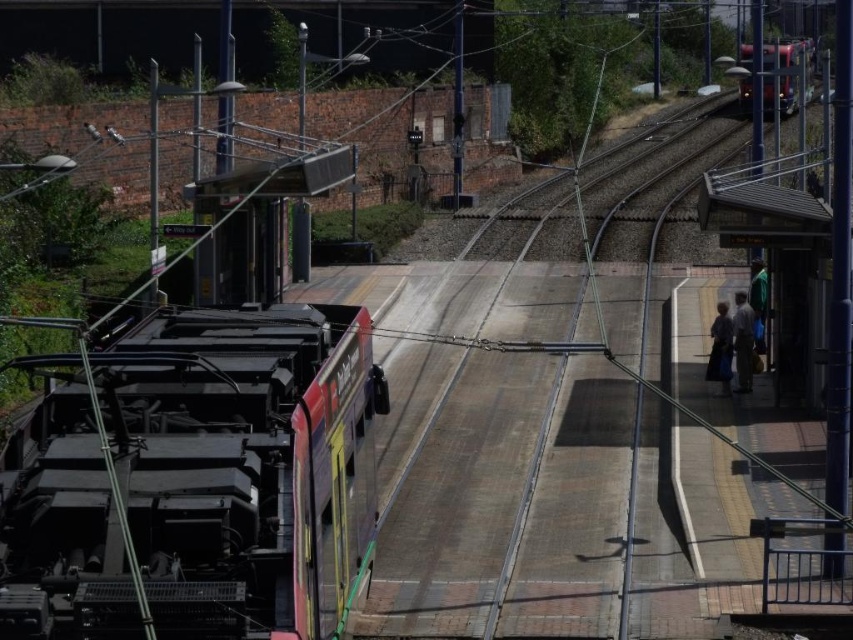
Question: Which point is closer to the camera?

Choices:
 (A) dark gray fabric bag at right
 (B) metallic red train at upper right
 (C) green fabric jacket at right

Answer: (A)

Question: From the image, what is the correct spatial relationship of dark gray fabric bag at right in relation to green fabric jacket at right?

Choices:
 (A) below
 (B) above

Answer: (A)

Question: Is metallic red train at left wider than light brown fabric coat at right?

Choices:
 (A) yes
 (B) no

Answer: (A)

Question: Among these points, which one is farthest from the camera?

Choices:
 (A) (740, 355)
 (B) (711, 352)

Answer: (B)

Question: Which point is closer to the camera?

Choices:
 (A) (294, 550)
 (B) (737, 330)
 (C) (712, 356)
 (D) (784, 67)

Answer: (A)

Question: Is metallic red train at left smaller than metallic red train at upper right?

Choices:
 (A) yes
 (B) no

Answer: (A)